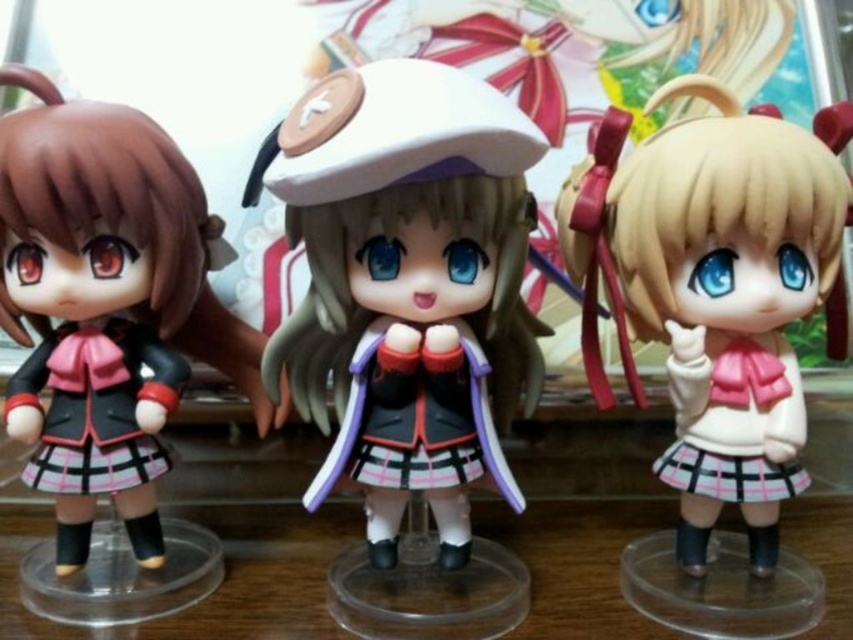
Who is more forward, (485, 518) or (93, 337)?

Point (93, 337) is more forward.

Describe the element at coordinates (224, 576) in the screenshot. I see `transparent plastic table at center` at that location.

What do you see at coordinates (224, 576) in the screenshot? Image resolution: width=853 pixels, height=640 pixels. I see `transparent plastic table at center` at bounding box center [224, 576].

The width and height of the screenshot is (853, 640). Identify the location of transparent plastic table at center. (224, 576).

Does point (332, 202) lie in front of point (44, 380)?

Yes, it is.

Does satin white beret at center have a greater width compared to matte black school uniform at left?

Correct, the width of satin white beret at center exceeds that of matte black school uniform at left.

Who is more distant from viewer, (322, 346) or (155, 442)?

The point (322, 346) is more distant.

Locate an element on the screen. This screenshot has height=640, width=853. satin white beret at center is located at coordinates (407, 284).

Can you confirm if satin white beret at center is positioned to the right of matte black doll at left?

Indeed, satin white beret at center is positioned on the right side of matte black doll at left.

Who is lower down, satin white beret at center or matte black doll at left?

matte black doll at left is below.

Between point (346, 278) and point (200, 301), which one is positioned in front?

Point (346, 278) is more forward.

Where is `satin white beret at center`? satin white beret at center is located at coordinates (407, 284).